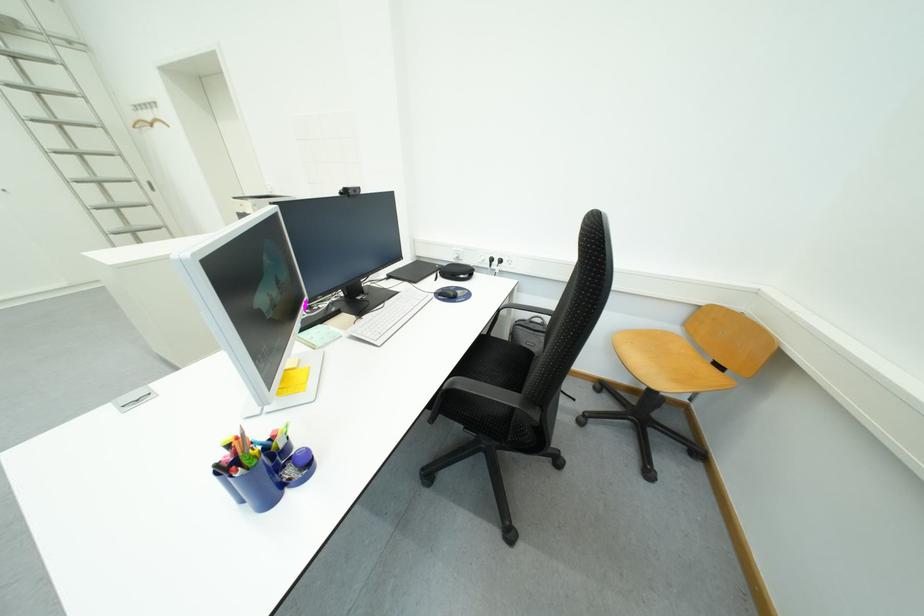
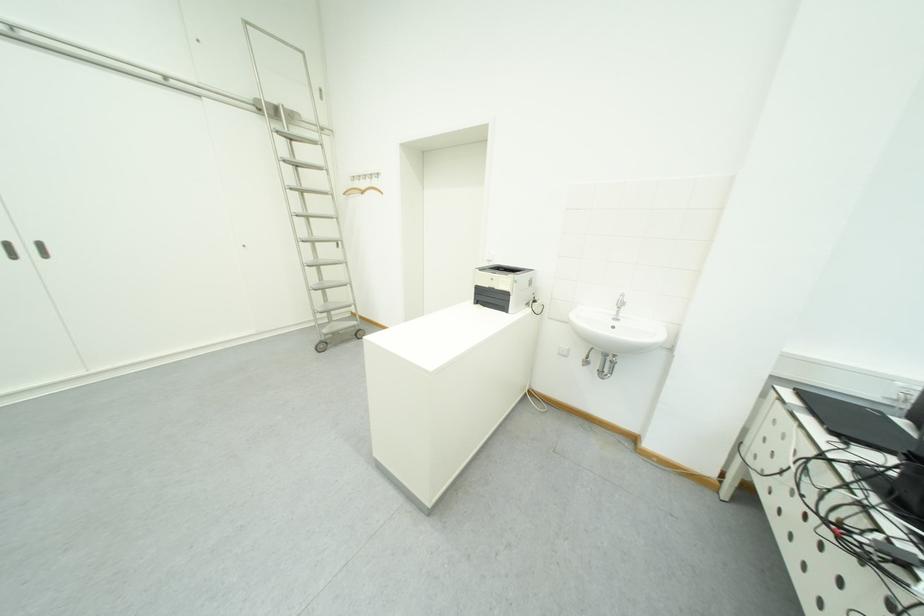
Where in the second image is the point corresponding to pixel 157 118 from the first image?

(372, 185)